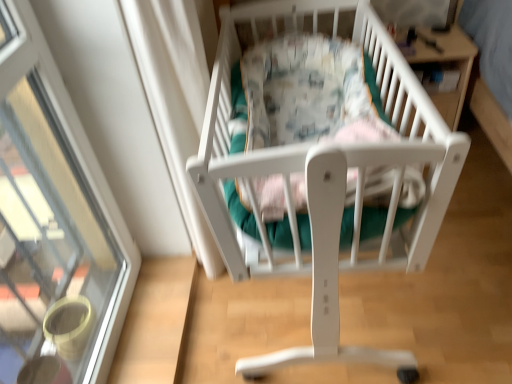
Question: Based on their positions, is transparent glass door at upper left located to the left or right of wooden table at upper right?

Choices:
 (A) left
 (B) right

Answer: (A)

Question: From a real-world perspective, is transparent glass door at upper left positioned above or below wooden table at upper right?

Choices:
 (A) above
 (B) below

Answer: (A)

Question: Estimate the real-world distances between objects in this image. Which object is farther from the wooden table at upper right?

Choices:
 (A) transparent glass door at upper left
 (B) white matte infant bed at center

Answer: (A)

Question: Which object is positioned farthest from the white matte infant bed at center?

Choices:
 (A) wooden table at upper right
 (B) transparent glass door at upper left

Answer: (A)